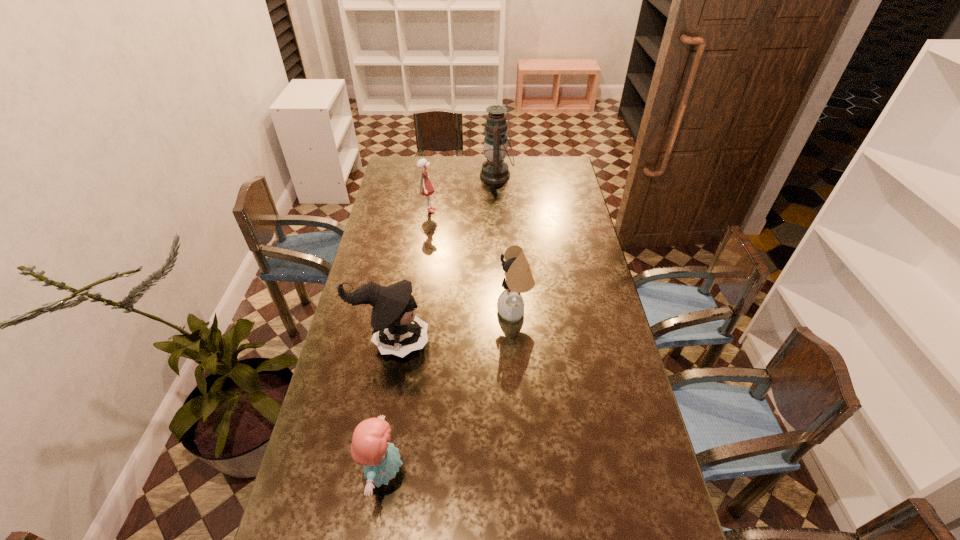
Locate which object is the second closest to the farthest doll. Please provide its 2D coordinates. Your answer should be formatted as a tuple, i.e. [(x, y)], where the tuple contains the x and y coordinates of a point satisfying the conditions above.

[(519, 279)]

You are a GUI agent. You are given a task and a screenshot of the screen. Output one action in this format:
    pyautogui.click(x=<x>, y=<y>)
    Task: Click on the object identified as the second closest to the tallest object
    This screenshot has height=540, width=960.
    Given the screenshot: What is the action you would take?
    pyautogui.click(x=519, y=279)

At what (x,y) coordinates should I click in order to perform the action: click on doll that stands as the third closest to the second farthest object. Please return your answer as a coordinate pair (x, y). Looking at the image, I should click on (370, 447).

Select which doll is the closest to the tallest object. Please provide its 2D coordinates. Your answer should be formatted as a tuple, i.e. [(x, y)], where the tuple contains the x and y coordinates of a point satisfying the conditions above.

[(425, 188)]